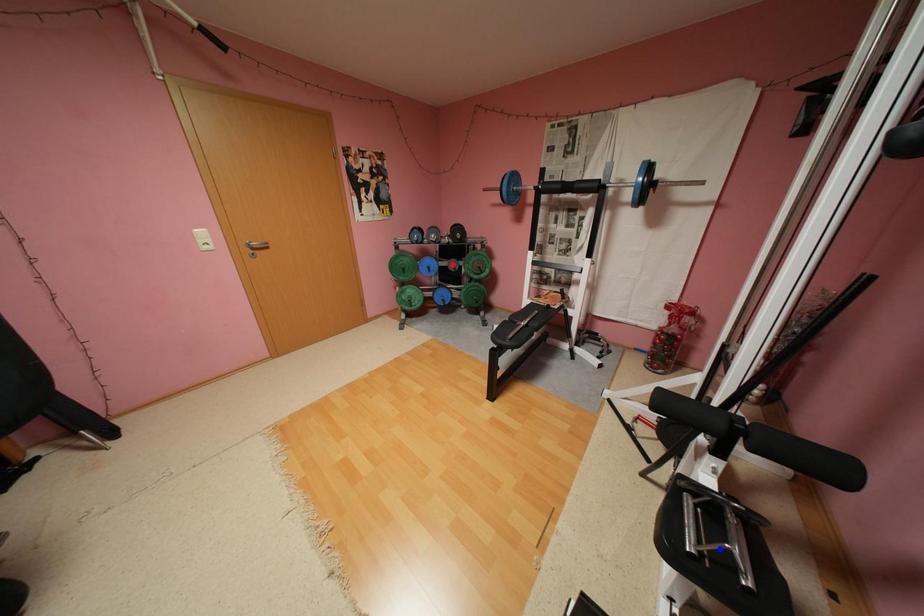
Question: In the image, two points are highlighted. Which point is nearer to the camera? Reply with the corresponding letter.

Choices:
 (A) blue point
 (B) red point

Answer: (A)